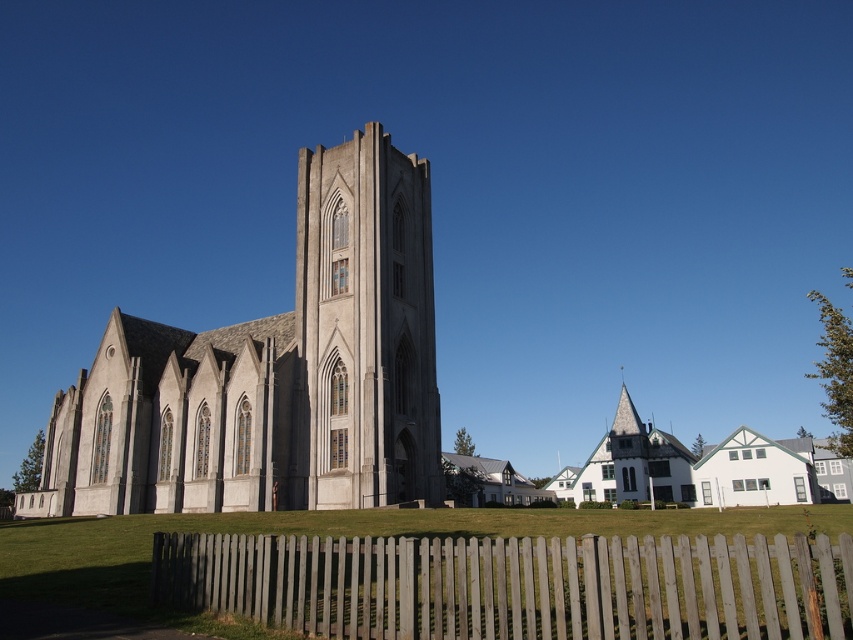
Does point (335, 484) come closer to viewer compared to point (612, 452)?

Yes, it is.

Is gray stone church at center below white painted wood church at center?

Actually, gray stone church at center is above white painted wood church at center.

Who is more forward, (277, 396) or (624, 428)?

Point (277, 396) is more forward.

Image resolution: width=853 pixels, height=640 pixels. Identify the location of gray stone church at center. (274, 372).

Which of these two, gray stone church at center or gray wooden fence at lower center, stands taller?

gray stone church at center

Is gray stone church at center further to camera compared to gray wooden fence at lower center?

Yes, it is.

Does point (422, 380) come farther from viewer compared to point (618, 541)?

Yes, it is behind point (618, 541).

I want to click on gray stone church at center, so click(x=274, y=372).

Is point (335, 604) more distant than point (328, 250)?

No, it is not.

Is point (602, 548) positioned after point (395, 410)?

No, (602, 548) is closer to viewer.

You are a GUI agent. You are given a task and a screenshot of the screen. Output one action in this format:
    pyautogui.click(x=<x>, y=<y>)
    Task: Click on the gray wooden fence at lower center
    
    Given the screenshot: What is the action you would take?
    pyautogui.click(x=514, y=586)